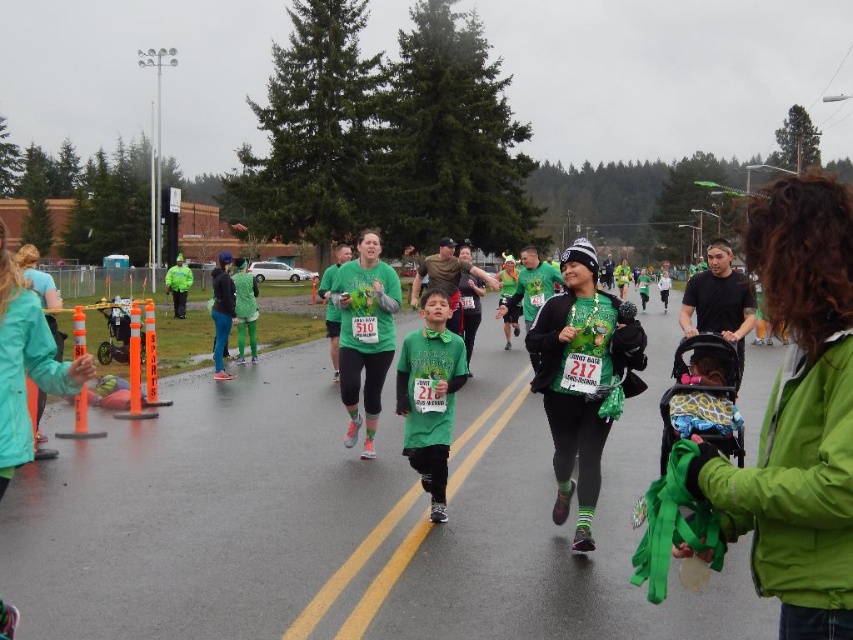
Who is shorter, green matte jacket at center or matte green jacket at center?

green matte jacket at center

The width and height of the screenshot is (853, 640). Find the location of `green matte jacket at center`. green matte jacket at center is located at coordinates (798, 412).

Find the location of `green matte jacket at center`. green matte jacket at center is located at coordinates (798, 412).